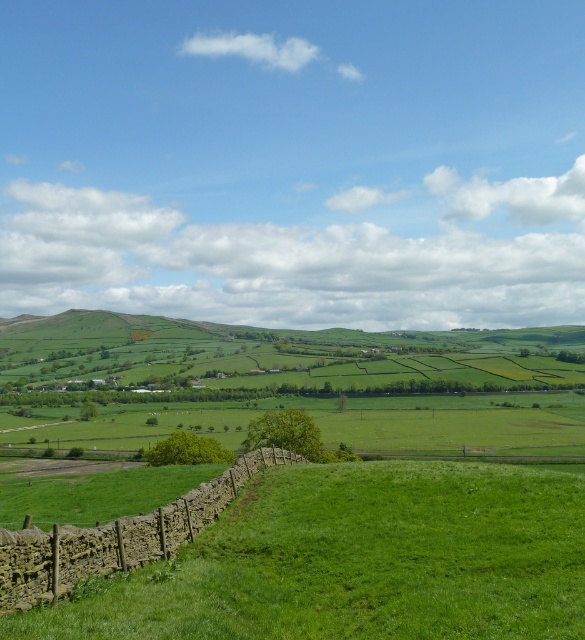
Looking at this image, who is more forward, (545, 328) or (29, 588)?

Positioned in front is point (29, 588).

This screenshot has width=585, height=640. What do you see at coordinates (277, 355) in the screenshot? I see `green grassy hillside at center` at bounding box center [277, 355].

Where is `green grassy hillside at center`? The height and width of the screenshot is (640, 585). green grassy hillside at center is located at coordinates pyautogui.click(x=277, y=355).

Describe the element at coordinates (357, 561) in the screenshot. I see `green grassy at lower left` at that location.

Between point (494, 499) and point (87, 557), which one is positioned behind?

Positioned behind is point (494, 499).

Which is behind, point (497, 474) or point (39, 579)?

The point (497, 474) is behind.

Identify the location of green grassy at lower left. (357, 561).

Consider the image. Is green grassy at lower left in front of green grassy hillside at center?

Yes.

What do you see at coordinates (357, 561) in the screenshot? This screenshot has height=640, width=585. I see `green grassy at lower left` at bounding box center [357, 561].

I want to click on green grassy at lower left, so click(x=357, y=561).